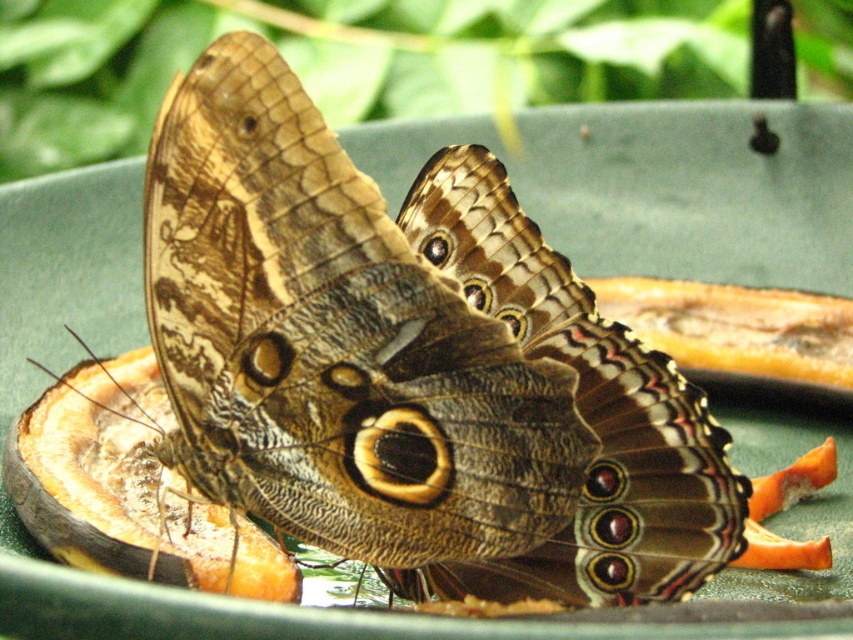
Question: Which point appears closest to the camera in this image?

Choices:
 (A) pos(157,392)
 (B) pos(477,573)

Answer: (B)

Question: Is brown textured butterfly at center closer to the viewer compared to smooth orange peel at center?

Choices:
 (A) no
 (B) yes

Answer: (B)

Question: Does brown textured butterfly at center appear under smooth orange peel at center?

Choices:
 (A) yes
 (B) no

Answer: (B)

Question: Does brown textured butterfly at center appear over smooth orange peel at center?

Choices:
 (A) no
 (B) yes

Answer: (B)

Question: Which of the following is the closest to the observer?

Choices:
 (A) smooth orange peel at center
 (B) brown textured butterfly at center

Answer: (B)